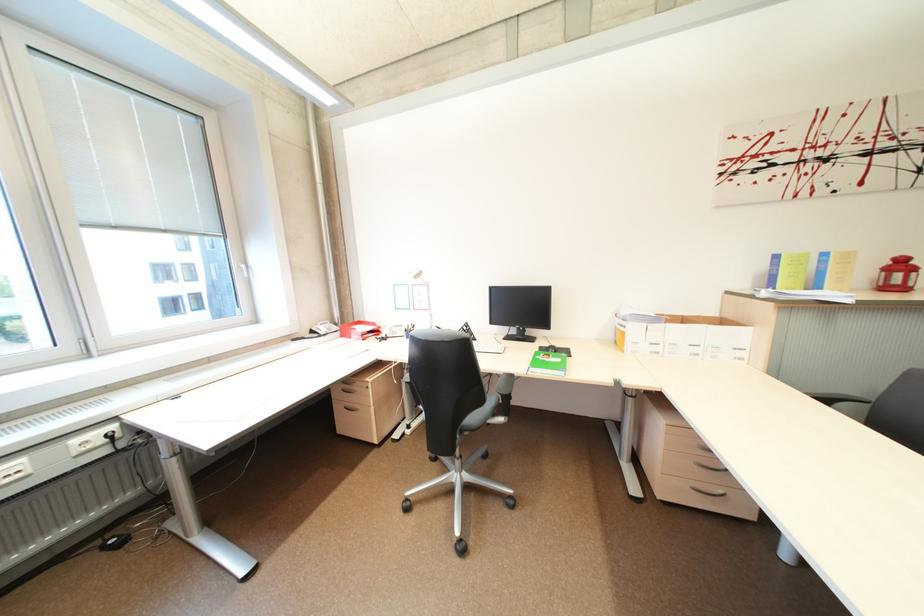
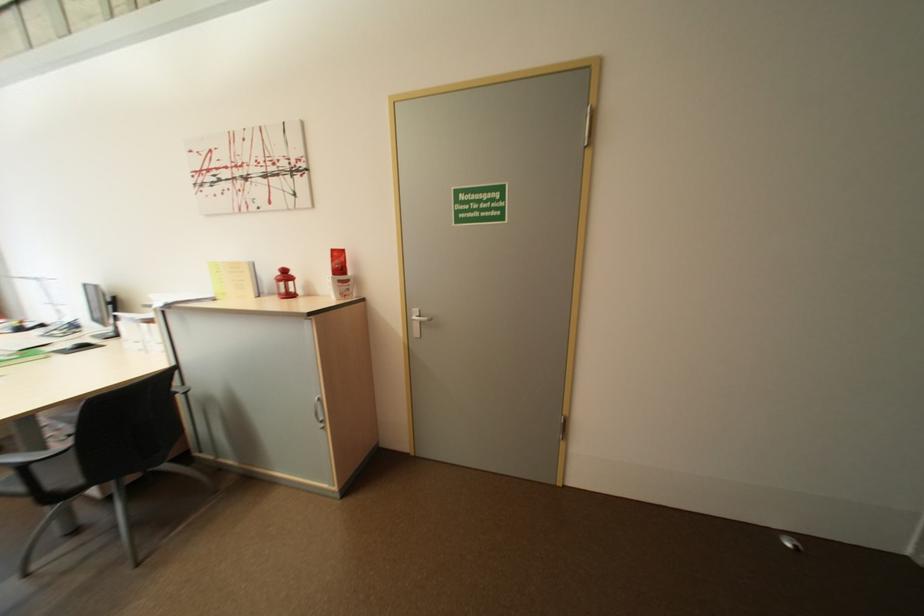
Question: The images are taken continuously from a first-person perspective. In which direction are you moving?

Choices:
 (A) Left
 (B) Right
 (C) Forward
 (D) Backward

Answer: (B)